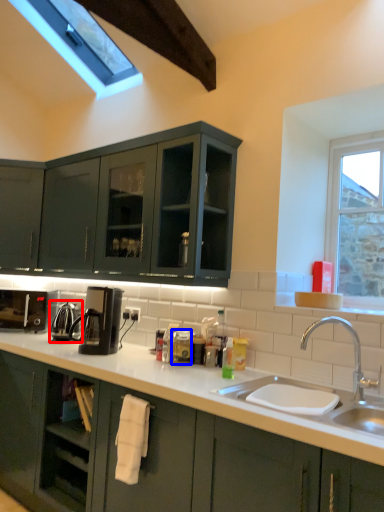
Question: Which object appears farthest to the camera in this image, appliance (highlighted by a red box) or appliance (highlighted by a blue box)?

Choices:
 (A) appliance
 (B) appliance

Answer: (A)